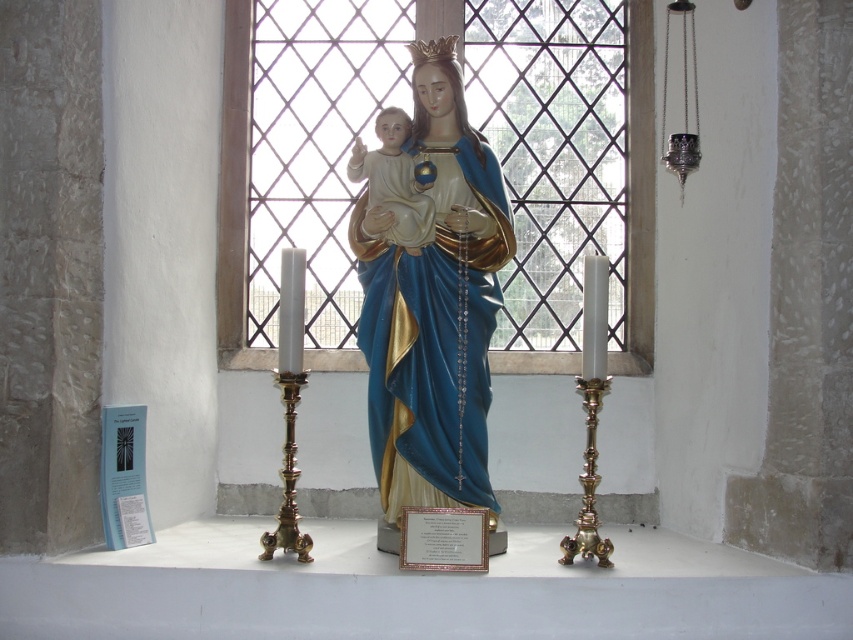
Who is lower down, clear glass window at center or matte blue statue at center?

matte blue statue at center is below.

Can you confirm if clear glass window at center is positioned to the right of matte blue statue at center?

Indeed, clear glass window at center is positioned on the right side of matte blue statue at center.

Locate an element on the screen. The image size is (853, 640). clear glass window at center is located at coordinates (473, 124).

You are a GUI agent. You are given a task and a screenshot of the screen. Output one action in this format:
    pyautogui.click(x=<x>, y=<y>)
    Task: Click on the clear glass window at center
    This screenshot has height=640, width=853.
    Given the screenshot: What is the action you would take?
    pyautogui.click(x=473, y=124)

Is matte blue statue at center positioned before matte porcelain baby at center?

Yes.

Can you confirm if matte blue statue at center is positioned to the left of matte porcelain baby at center?

Incorrect, matte blue statue at center is not on the left side of matte porcelain baby at center.

Who is more distant from viewer, (392,257) or (398,232)?

Point (392,257)

Locate an element on the screen. The width and height of the screenshot is (853, 640). matte blue statue at center is located at coordinates (430, 296).

Between clear glass window at center and matte porcelain baby at center, which one appears on the right side from the viewer's perspective?

Positioned to the right is clear glass window at center.

Between point (531, 38) and point (386, 148), which one is positioned behind?

The point (531, 38) is behind.

This screenshot has height=640, width=853. What are the coordinates of `clear glass window at center` in the screenshot? It's located at (473, 124).